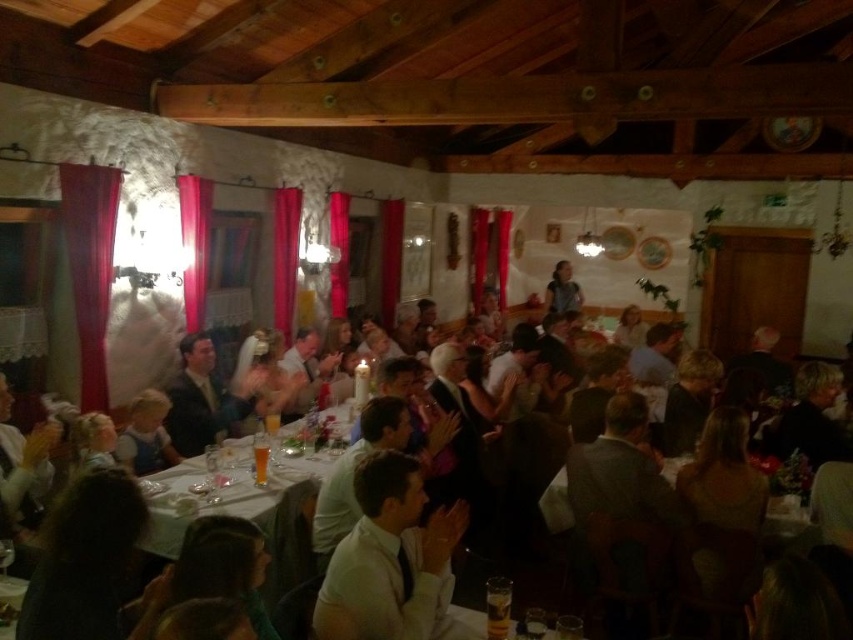
Who is positioned more to the left, white satin shirt at center or matte black dress at center?

Positioned to the left is white satin shirt at center.

Who is more forward, [370,598] or [556,310]?

Positioned in front is point [370,598].

Image resolution: width=853 pixels, height=640 pixels. I want to click on white satin shirt at center, so click(x=389, y=557).

This screenshot has height=640, width=853. Describe the element at coordinates (194, 244) in the screenshot. I see `pink fabric curtain at left` at that location.

The width and height of the screenshot is (853, 640). Identify the location of pink fabric curtain at left. (194, 244).

Locate an element on the screen. pink fabric curtain at left is located at coordinates (194, 244).

Who is lower down, red velvet curtain at left or matte black dress at center?

red velvet curtain at left is below.

At what (x,y) coordinates should I click in order to perform the action: click on red velvet curtain at left. Please return your answer as a coordinate pair (x, y). Image resolution: width=853 pixels, height=640 pixels. Looking at the image, I should click on (90, 266).